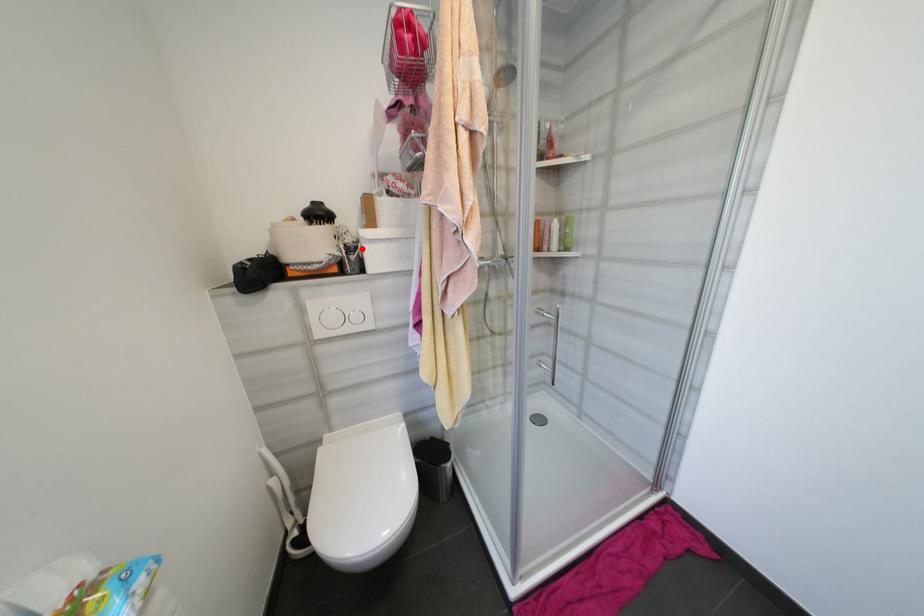
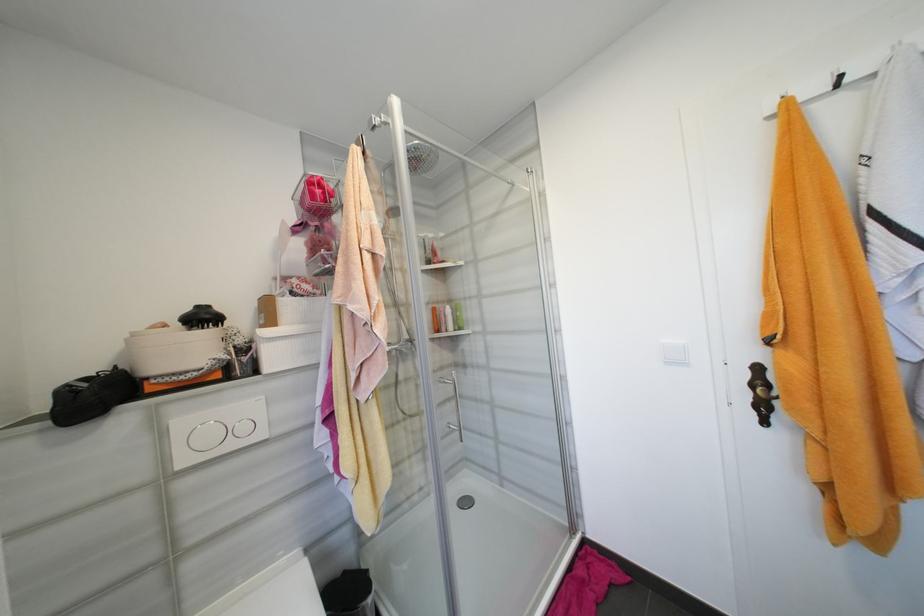
In the second image, find the point that corresponds to the highlighted location in the first image.

(256, 349)